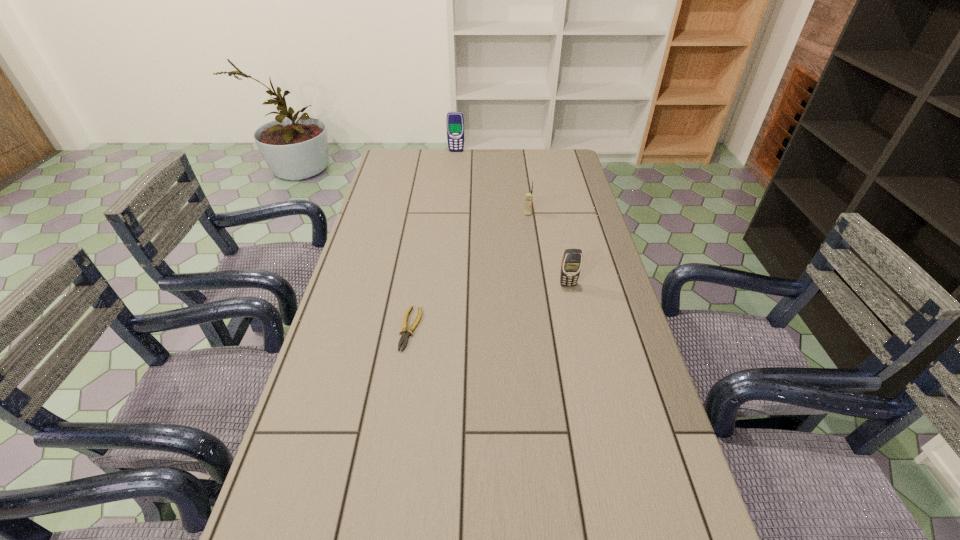
Find the location of `free space located on the front face of the rightmost cellular telephone`. free space located on the front face of the rightmost cellular telephone is located at coordinates (577, 327).

You are a GUI agent. You are given a task and a screenshot of the screen. Output one action in this format:
    pyautogui.click(x=<x>, y=<y>)
    Task: Click on the blank space located 0.320m on the front of the shortest object
    
    Given the screenshot: What is the action you would take?
    pyautogui.click(x=387, y=482)

What are the coordinates of `object at the far edge` in the screenshot? It's located at tap(455, 121).

Find the location of `object that is at the right edge`. object that is at the right edge is located at coordinates (571, 264).

Where is `free location at the far edge of the desktop`? free location at the far edge of the desktop is located at coordinates (453, 160).

Where is `vacant region at the left edge of the desktop`? The height and width of the screenshot is (540, 960). vacant region at the left edge of the desktop is located at coordinates (391, 185).

Where is `vacant area at the right edge of the desktop`? vacant area at the right edge of the desktop is located at coordinates (575, 200).

Image resolution: width=960 pixels, height=540 pixels. What are the coordinates of `vacant region at the far right corner of the desktop` in the screenshot? It's located at (561, 177).

Find the location of a particular element. The height and width of the screenshot is (540, 960). unoccupied area between the leftmost cellular telephone and the second farthest object is located at coordinates (492, 183).

Locate an element on the screen. vacant point located between the second cellular telephone from right to left and the nearest cellular telephone is located at coordinates click(x=548, y=249).